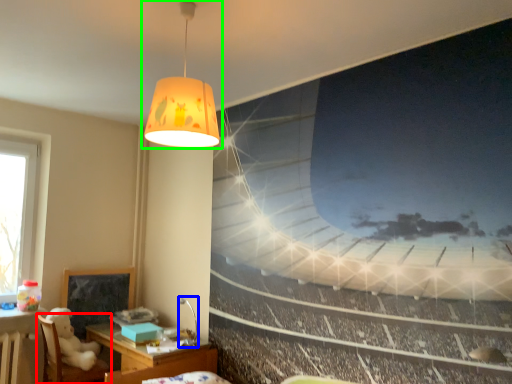
Question: Estimate the real-world distances between objects in this image. Which object is farther from furniture (highlighted by a red box), lamp (highlighted by a blue box) or lamp (highlighted by a green box)?

Choices:
 (A) lamp
 (B) lamp

Answer: (B)